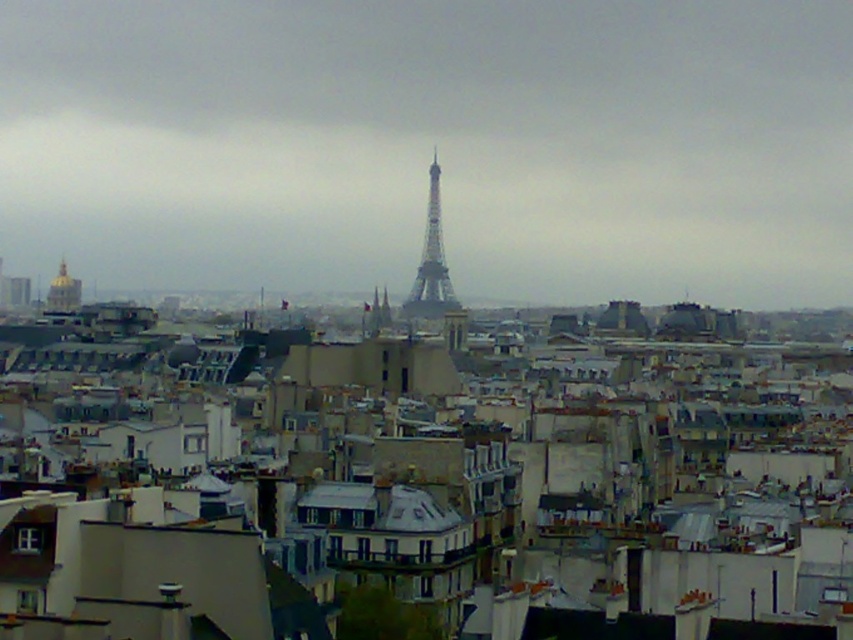
Is transparent glass eiffel tower at center taller than gold dome at upper left?

Indeed, transparent glass eiffel tower at center has a greater height compared to gold dome at upper left.

Is point (695, 134) closer to camera compared to point (62, 275)?

No.

Which is behind, point (389, 129) or point (54, 284)?

Positioned behind is point (389, 129).

You are a GUI agent. You are given a task and a screenshot of the screen. Output one action in this format:
    pyautogui.click(x=<x>, y=<y>)
    Task: Click on the transparent glass eiffel tower at center
    Image resolution: width=853 pixels, height=640 pixels.
    Given the screenshot: What is the action you would take?
    pyautogui.click(x=433, y=144)

Is metallic gray eiffel tower at center thinner than gold dome at upper left?

Yes.

Between metallic gray eiffel tower at center and gold dome at upper left, which one has less height?

gold dome at upper left is shorter.

Is point (428, 284) farther from camera compared to point (59, 268)?

No, it is not.

Image resolution: width=853 pixels, height=640 pixels. Identify the location of metallic gray eiffel tower at center. coord(431,262).

Between point (221, 10) and point (431, 204), which one is positioned in front?

Point (431, 204) is more forward.

Describe the element at coordinates (433, 144) in the screenshot. I see `transparent glass eiffel tower at center` at that location.

The width and height of the screenshot is (853, 640). Find the location of `transparent glass eiffel tower at center`. transparent glass eiffel tower at center is located at coordinates click(433, 144).